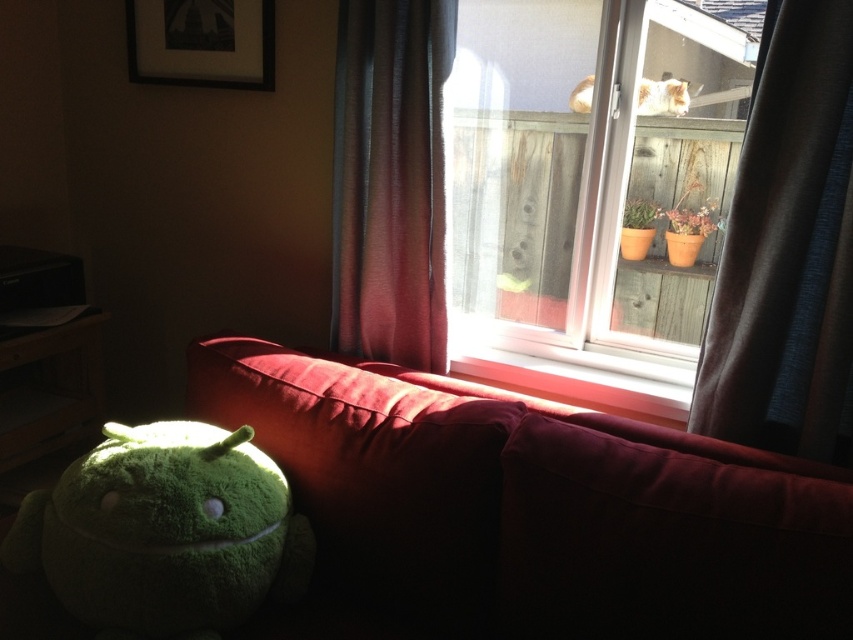
You are standing at the camera position and want to reach the point marked as point (x=460, y=528). Can you walk directly to it without moving around any furniture?

The distance between you and point (x=460, y=528) is 1.31 meters. Since there are no obstacles mentioned between you and the point, you can walk directly to it.

You are designing a new room layout and need to place a large painting that is 3 feet wide. You have two options for placement areas based on the objects in the scene. The first area is where the dark gray fabric curtain at right is currently located, and the second area is where the white fluffy cat at upper center is. Which location has enough space to accommodate the painting without overlapping other objects?

The white fluffy cat at upper center is located in an area with more space since the dark gray fabric curtain at right has a smaller width compared to the white fluffy cat at upper center. Therefore, the area where the white fluffy cat at upper center is placed can accommodate the 3 feet wide painting without overlapping other objects.

You are an interior designer planning to place a new sofa in this room. The velvet red couch at lower left is currently occupying space. How does its size compare to the transparent glass window at upper center in terms of width?

The velvet red couch at lower left is wider than the transparent glass window at upper center.